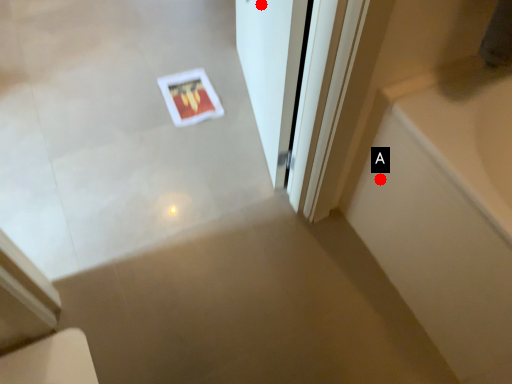
Question: Two points are circled on the image, labeled by A and B beside each circle. Which point is closer to the camera taking this photo?

Choices:
 (A) A is closer
 (B) B is closer

Answer: (A)